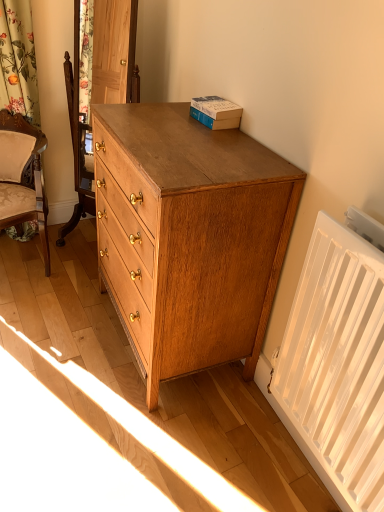
Question: From the image's perspective, is white plastic radiator at lower right located above or below matte oak chest of drawers at right?

Choices:
 (A) below
 (B) above

Answer: (A)

Question: In terms of width, does white plastic radiator at lower right look wider or thinner when compared to matte oak chest of drawers at right?

Choices:
 (A) wide
 (B) thin

Answer: (B)

Question: Which object is positioned farthest from the hardcover book at upper right?

Choices:
 (A) matte oak chest of drawers at right
 (B) beige upholstered chair at left
 (C) white plastic radiator at lower right

Answer: (B)

Question: Which object is positioned farthest from the beige upholstered chair at left?

Choices:
 (A) matte oak chest of drawers at right
 (B) hardcover book at upper right
 (C) white plastic radiator at lower right

Answer: (C)